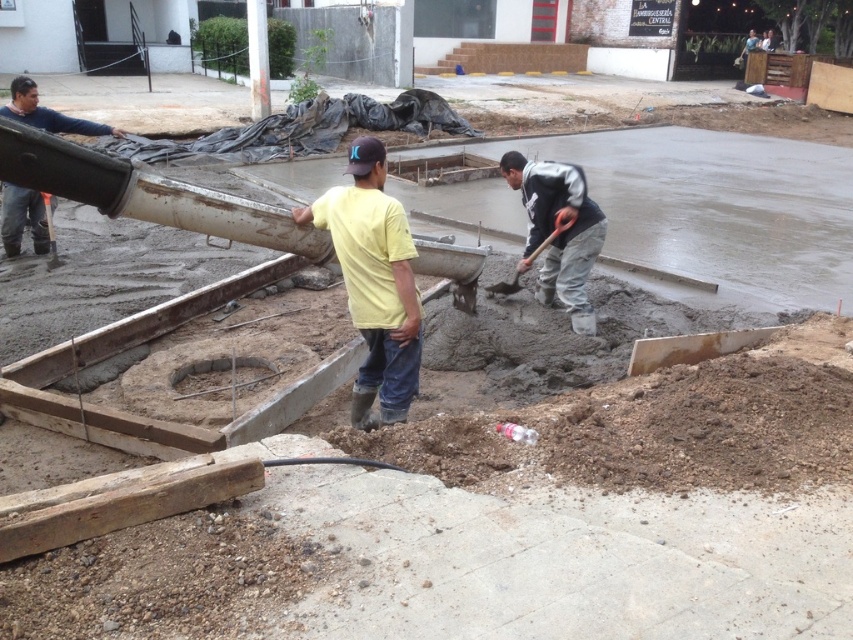
Is yellow matte shirt at center in front of metallic gray shovel at center?

That is True.

Is yellow matte shirt at center shorter than metallic gray shovel at center?

No.

At what (x,y) coordinates should I click in order to perform the action: click on yellow matte shirt at center. Please return your answer as a coordinate pair (x, y). This screenshot has width=853, height=640. Looking at the image, I should click on (374, 282).

Who is more distant from viewer, (48, 128) or (537, 252)?

The point (48, 128) is more distant.

Which is in front, point (15, 202) or point (549, 241)?

Positioned in front is point (549, 241).

Describe the element at coordinates (47, 113) in the screenshot. I see `matte black pipe at left` at that location.

You are a GUI agent. You are given a task and a screenshot of the screen. Output one action in this format:
    pyautogui.click(x=<x>, y=<y>)
    Task: Click on the matte black pipe at left
    This screenshot has height=640, width=853.
    Given the screenshot: What is the action you would take?
    pyautogui.click(x=47, y=113)

Which is below, gray concrete shovel at center or metallic gray shovel at center?

metallic gray shovel at center is lower down.

Which of these two, gray concrete shovel at center or metallic gray shovel at center, stands shorter?

Standing shorter between the two is metallic gray shovel at center.

Identify the location of gray concrete shovel at center. The width and height of the screenshot is (853, 640). (560, 232).